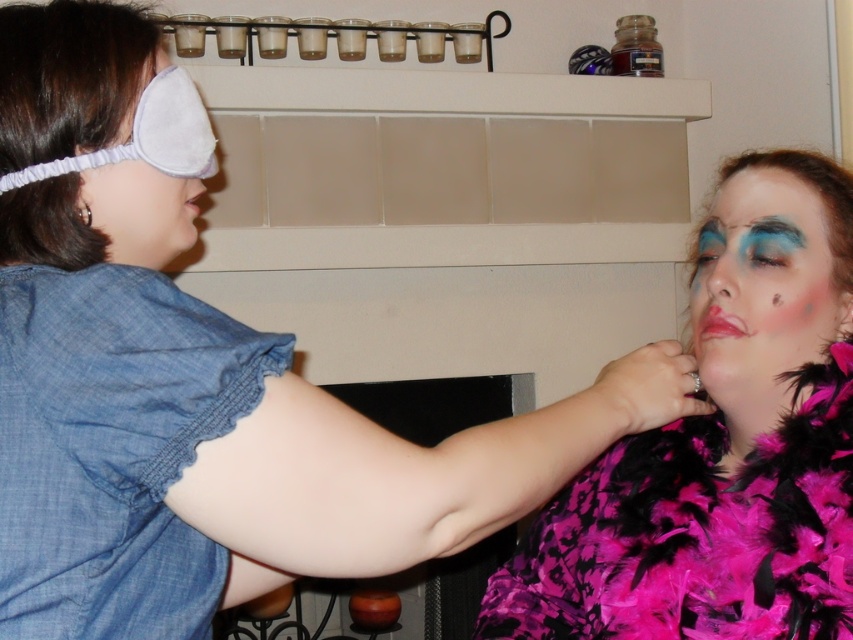
Question: Among these objects, which one is nearest to the camera?

Choices:
 (A) matte pink feather boa at right
 (B) denim fabric dress at left

Answer: (B)

Question: Can you confirm if denim fabric dress at left is bigger than gray fabric eye mask at left?

Choices:
 (A) no
 (B) yes

Answer: (B)

Question: Estimate the real-world distances between objects in this image. Which object is closer to the matte pink feather boa at right?

Choices:
 (A) denim fabric dress at left
 (B) fuzzy pink feather boa at center
 (C) gray fabric eye mask at left

Answer: (B)

Question: Among these points, which one is nearest to the camera?

Choices:
 (A) pyautogui.click(x=786, y=564)
 (B) pyautogui.click(x=100, y=268)

Answer: (B)

Question: Does fuzzy pink feather boa at center appear on the left side of denim fabric dress at left?

Choices:
 (A) yes
 (B) no

Answer: (B)

Question: Observing the image, what is the correct spatial positioning of denim fabric dress at left in reference to matte pink feather boa at right?

Choices:
 (A) below
 (B) above

Answer: (A)